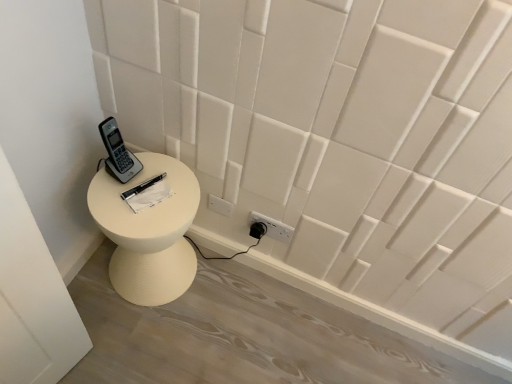
Where is `free space in front of gray plastic phone at upper left`? This screenshot has height=384, width=512. free space in front of gray plastic phone at upper left is located at coordinates (116, 203).